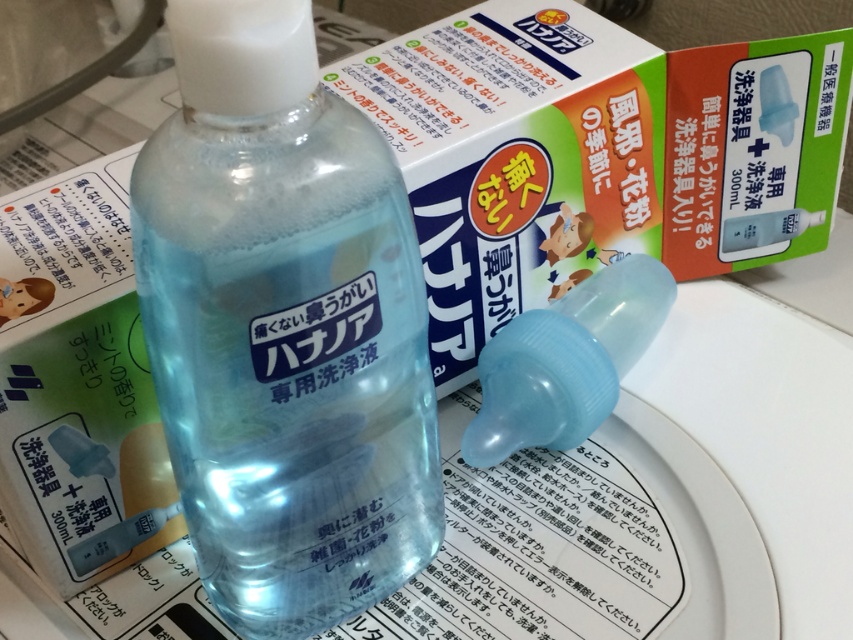
Who is positioned more to the right, transparent plastic bottle at center or transparent plastic nasal spray at center?

transparent plastic nasal spray at center is more to the right.

What do you see at coordinates (283, 326) in the screenshot? This screenshot has width=853, height=640. I see `transparent plastic bottle at center` at bounding box center [283, 326].

Who is more forward, (257, 515) or (646, 253)?

Point (257, 515) is more forward.

Where is `transparent plastic bottle at center`? The width and height of the screenshot is (853, 640). transparent plastic bottle at center is located at coordinates (283, 326).